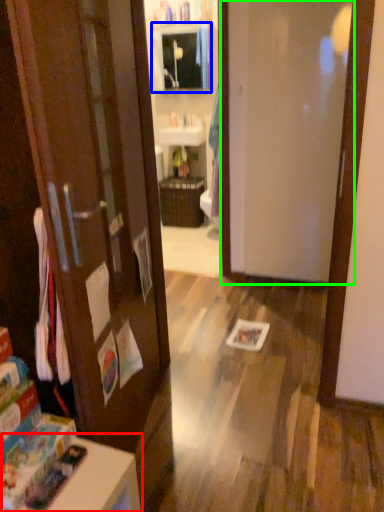
Question: Which object is positioned farthest from table (highlighted by a red box)? Select from medicine cabinet (highlighted by a blue box) and door (highlighted by a green box).

Choices:
 (A) medicine cabinet
 (B) door

Answer: (A)